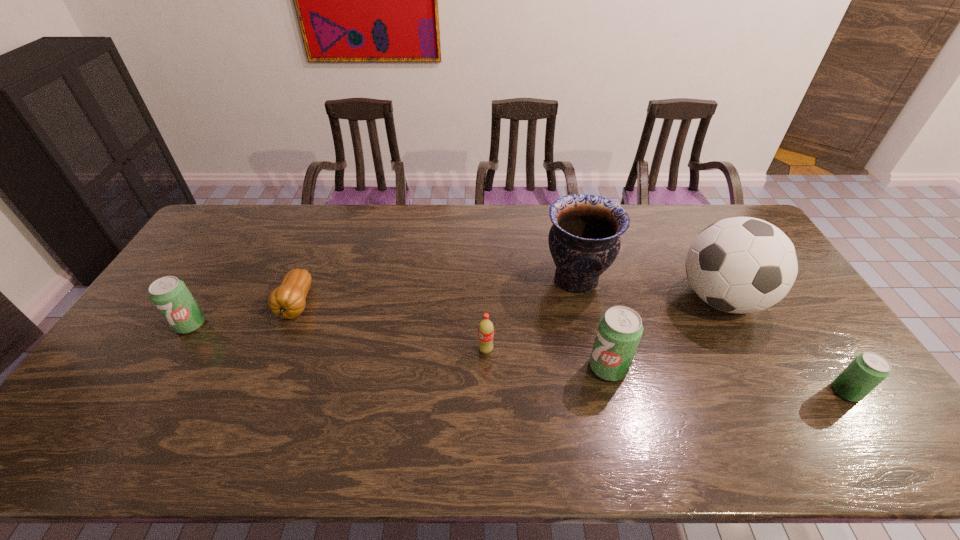
You are a GUI agent. You are given a task and a screenshot of the screen. Output one action in this format:
    pyautogui.click(x=<x>, y=<y>)
    Task: Click on the vacant point located between the third object from left to right and the rightmost soda
    This screenshot has width=960, height=540.
    Given the screenshot: What is the action you would take?
    pyautogui.click(x=666, y=370)

Identify the location of empty space that is in between the shortest object and the pottery. The width and height of the screenshot is (960, 540). (436, 292).

Find the location of a particular element. empty location between the rightmost soda and the second soda from left to right is located at coordinates (666, 370).

At what (x,y) coordinates should I click in order to perform the action: click on vacant area that lies between the sixth object from right to left and the tallest soda. Please return your answer as a coordinate pair (x, y). Looking at the image, I should click on (452, 336).

Where is `free space that is in between the leftmost soda and the third soda from right to left`? free space that is in between the leftmost soda and the third soda from right to left is located at coordinates (338, 337).

Find the location of `vacant space in between the soccer ball and the pottery`. vacant space in between the soccer ball and the pottery is located at coordinates (649, 289).

The image size is (960, 540). I want to click on free spot between the farthest soda and the second object from right to left, so click(x=456, y=312).

This screenshot has width=960, height=540. I want to click on free space between the pottery and the leftmost soda, so click(383, 301).

The width and height of the screenshot is (960, 540). Identify the location of unoccupied area between the tallest soda and the rightmost soda. (727, 379).

At what (x,y) coordinates should I click in order to perform the action: click on vacant area between the soccer ball and the sixth object from right to left. Please return your answer as a coordinate pair (x, y). The width and height of the screenshot is (960, 540). Looking at the image, I should click on (509, 302).